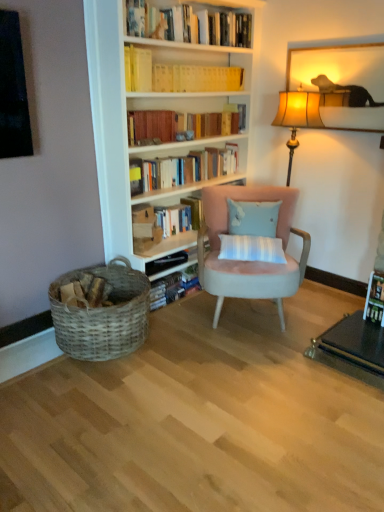
Identify the location of vacant area situated below wooden picture frame at upper right (from a real-world perspective). pos(327,283).